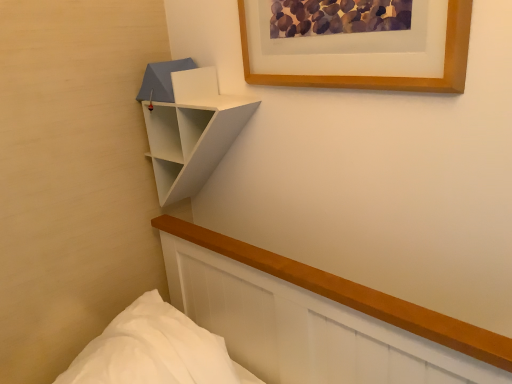
Question: Does white matte/shiny shelf at upper center have a lesser width compared to wooden picture frame at upper center?

Choices:
 (A) no
 (B) yes

Answer: (A)

Question: Considering the relative positions of white matte/shiny shelf at upper center and wooden picture frame at upper center in the image provided, is white matte/shiny shelf at upper center to the left of wooden picture frame at upper center from the viewer's perspective?

Choices:
 (A) no
 (B) yes

Answer: (B)

Question: From a real-world perspective, is white matte/shiny shelf at upper center physically below wooden picture frame at upper center?

Choices:
 (A) yes
 (B) no

Answer: (A)

Question: From a real-world perspective, does white matte/shiny shelf at upper center stand above wooden picture frame at upper center?

Choices:
 (A) yes
 (B) no

Answer: (B)

Question: Does white matte/shiny shelf at upper center appear on the right side of wooden picture frame at upper center?

Choices:
 (A) yes
 (B) no

Answer: (B)

Question: Considering the relative positions of white matte/shiny shelf at upper center and wooden picture frame at upper center in the image provided, is white matte/shiny shelf at upper center in front of wooden picture frame at upper center?

Choices:
 (A) yes
 (B) no

Answer: (B)

Question: From the image's perspective, is wooden picture frame at upper center on white matte/shiny shelf at upper center?

Choices:
 (A) yes
 (B) no

Answer: (A)

Question: Is the position of wooden picture frame at upper center less distant than that of white matte/shiny shelf at upper center?

Choices:
 (A) no
 (B) yes

Answer: (B)

Question: Does wooden picture frame at upper center have a smaller size compared to white matte/shiny shelf at upper center?

Choices:
 (A) no
 (B) yes

Answer: (B)

Question: Is wooden picture frame at upper center at the left side of white matte/shiny shelf at upper center?

Choices:
 (A) yes
 (B) no

Answer: (B)

Question: From the image's perspective, is wooden picture frame at upper center below white matte/shiny shelf at upper center?

Choices:
 (A) no
 (B) yes

Answer: (A)

Question: Is wooden picture frame at upper center bigger than white matte/shiny shelf at upper center?

Choices:
 (A) yes
 (B) no

Answer: (B)

Question: From the image's perspective, is wooden picture frame at upper center located above or below white matte/shiny shelf at upper center?

Choices:
 (A) above
 (B) below

Answer: (A)